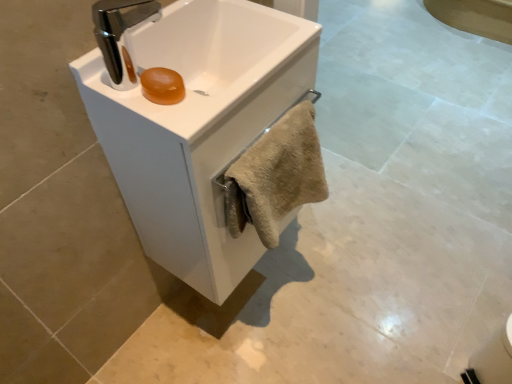
The height and width of the screenshot is (384, 512). I want to click on free space in front of white glossy sink at center, arranged as the second sink when viewed from the front, so click(240, 352).